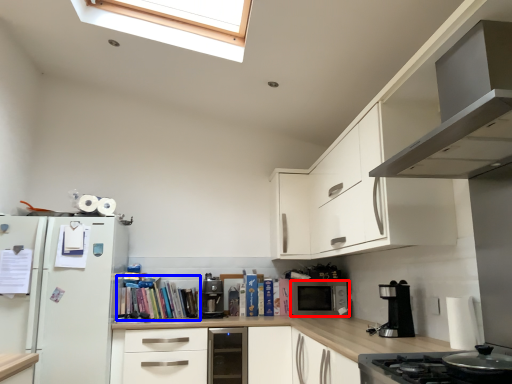
Question: Which of the following is the closest to the observer, microwave oven (highlighted by a red box) or book (highlighted by a blue box)?

Choices:
 (A) microwave oven
 (B) book

Answer: (B)